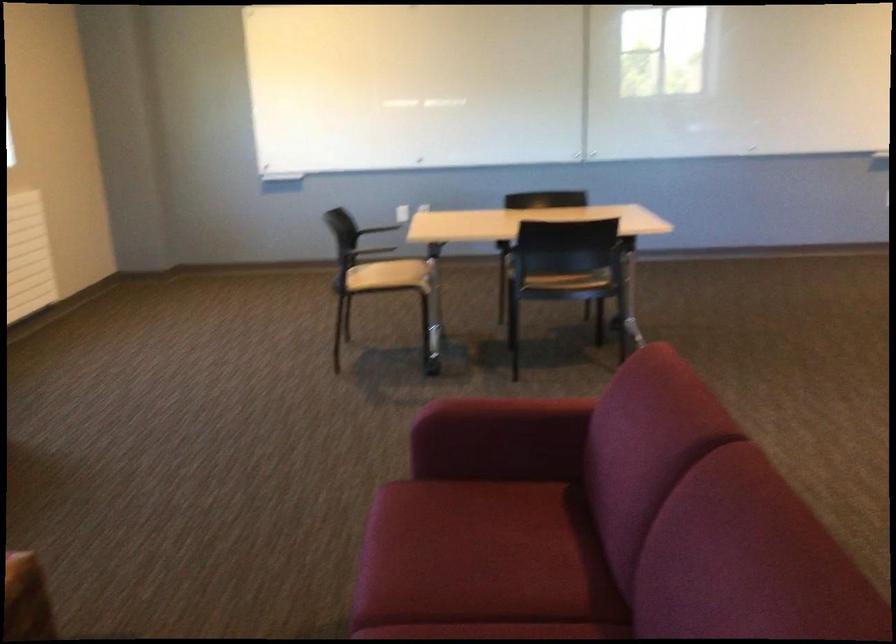
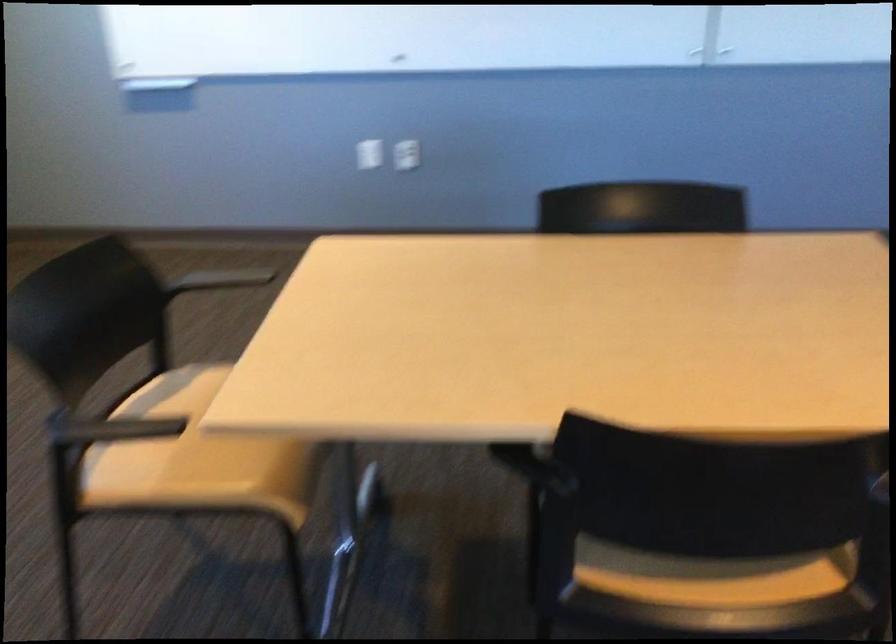
Find the pixel in the second image that matches the point at 581,279 in the first image.

(711, 576)